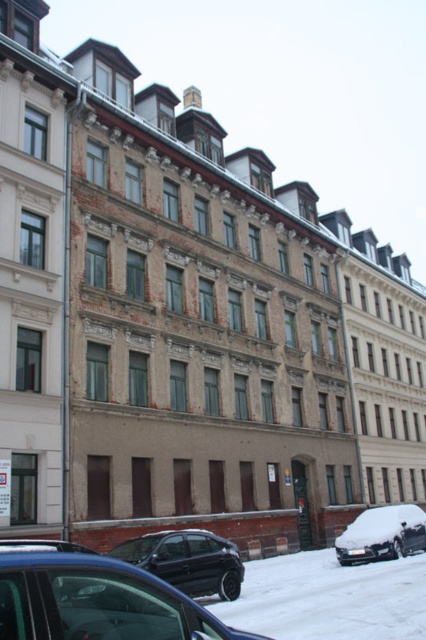
You are standing in front of the row of residential buildings and want to determine which of the two points, point (86, 609) or point (129, 554), is closer to you. Based on the image, which point is nearer?

Point (86, 609) is closer to the viewer than point (129, 554).